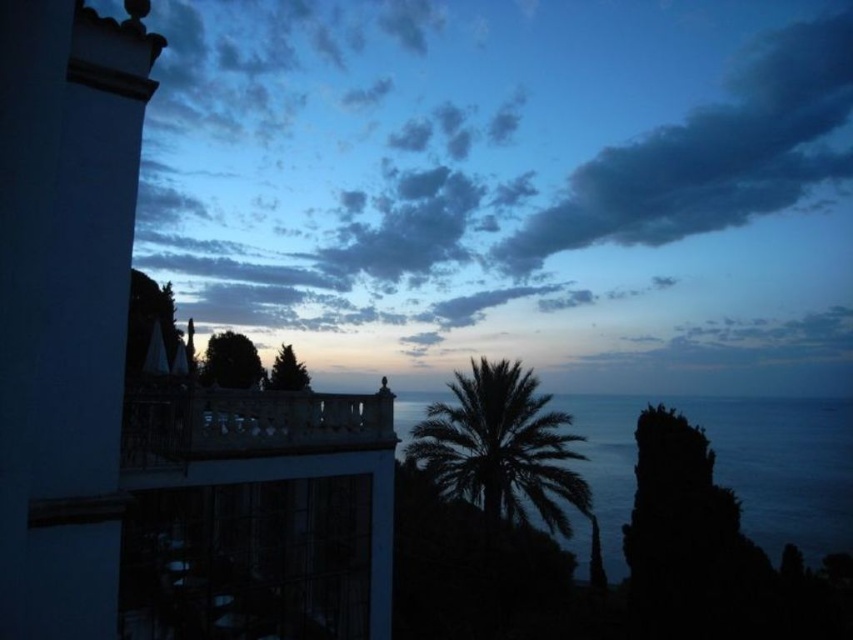
Based on the photo, you are standing at the point closest to the viewer in the coastal scene. Which point are you at, point (x=801, y=189) or point (x=344, y=520)?

You are at point (x=801, y=189) because it is further to the viewer than point (x=344, y=520).

You are an artist trying to paint the coastal scene. You need to decide which object should be placed higher in your painting to match the image. Which one should be higher, the dark gray cloud at upper right or the dark blue water at center?

The dark gray cloud at upper right should be placed higher in the painting because it is much taller than the dark blue water at center according to the description.